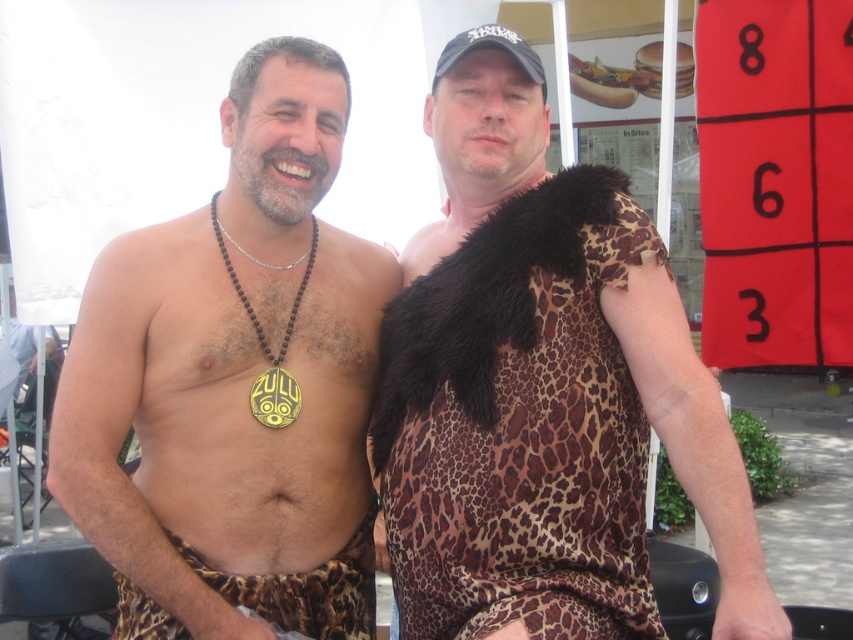
You are a photographer trying to capture a closeup of the leopard print loincloth at center. The camera you are using has a focal length of 50mm. To ensure the subject fills the frame, you need to position yourself at a certain distance. Given that the leopard print loincloth at center is represented by the point at coordinates point (235, 384), can you determine if you should move closer or farther away from the subject?

The leopard print loincloth at center is represented by point (235, 384). Since the coordinates are within the frame, you should move closer to the subject to ensure it fills the frame.

You are a photographer setting up a shoot under the tent. You have two leopard print fabrics available. The leopard print fabric dress at upper right and the leopard print fabric at lower center. Which one should you choose to cover a large prop that requires a bigger piece of fabric?

You should choose the leopard print fabric dress at upper right because it is larger in size than the leopard print fabric at lower center, making it suitable for covering a large prop.